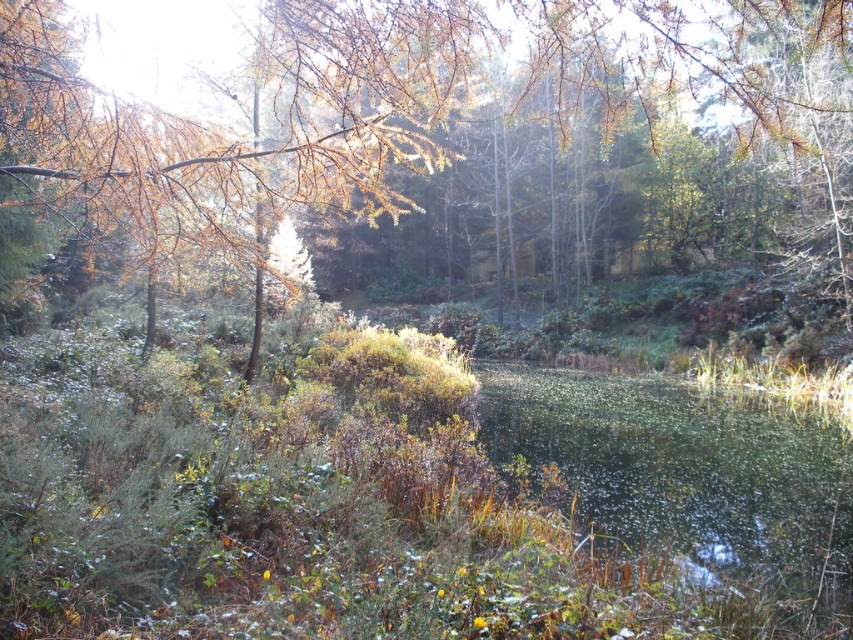
Describe the element at coordinates (463, 134) in the screenshot. The image size is (853, 640). I see `golden-brown branches at upper left` at that location.

Measure the distance between golden-brown branches at upper left and camera.

golden-brown branches at upper left is 3.92 meters from camera.

Image resolution: width=853 pixels, height=640 pixels. Identify the location of golden-brown branches at upper left. (463, 134).